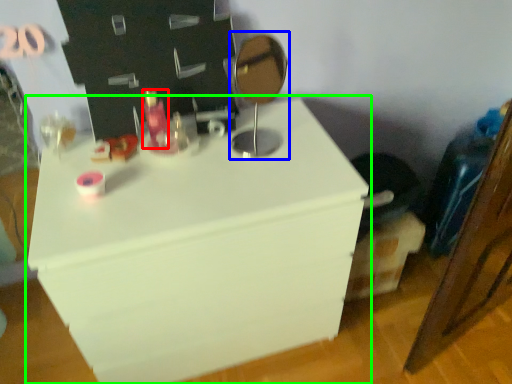
Question: Which is nearer to the toiletry (highlighted by a red box)? table lamp (highlighted by a blue box) or furniture (highlighted by a green box).

Choices:
 (A) table lamp
 (B) furniture

Answer: (A)